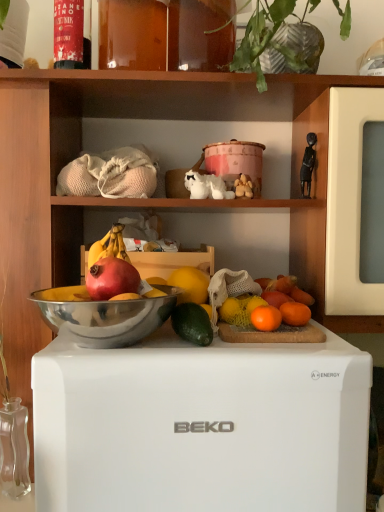
Measure the distance between point (299, 55) and camera.

The distance of point (299, 55) from camera is 36.10 inches.

Based on the photo, how much space does fuzzy beige stuffed animal at upper center, which ranks as the 2th toy in right-to-left order, occupy vertically?

It is 2.56 inches.

How much space does orange matte grapefruit at upper right, the 2th grapefruit in the right-to-left sequence, occupy vertically?

The height of orange matte grapefruit at upper right, the 2th grapefruit in the right-to-left sequence, is 1.46 inches.

This screenshot has height=512, width=384. What do you see at coordinates (295, 313) in the screenshot? I see `orange matte grapefruit at right, the 1th grapefruit in the right-to-left sequence` at bounding box center [295, 313].

At what (x,y) coordinates should I click in order to perform the action: click on green leafy plant at upper center. Please return your answer as a coordinate pair (x, y). This screenshot has height=512, width=384. Looking at the image, I should click on (269, 40).

Is orange matte grapefruit at right, positioned as the 3th grapefruit in front-to-back order, to the left or to the right of white matte refrigerator at center in the image?

Clearly, orange matte grapefruit at right, positioned as the 3th grapefruit in front-to-back order, is on the right of white matte refrigerator at center in the image.

Considering the relative sizes of orange matte grapefruit at right, the 3th grapefruit from the left, and white matte refrigerator at center in the image provided, is orange matte grapefruit at right, the 3th grapefruit from the left, thinner than white matte refrigerator at center?

Indeed, orange matte grapefruit at right, the 3th grapefruit from the left, has a lesser width compared to white matte refrigerator at center.

From the picture: What's the angular difference between orange matte grapefruit at right, the 3th grapefruit from the left, and white matte refrigerator at center's facing directions?

88.7 degrees separate the facing orientations of orange matte grapefruit at right, the 3th grapefruit from the left, and white matte refrigerator at center.

Are orange matte grapefruit at right, which ranks as the 1th grapefruit in back-to-front order, and white matte refrigerator at center beside each other?

No, orange matte grapefruit at right, which ranks as the 1th grapefruit in back-to-front order, is not touching white matte refrigerator at center.

Consider the image. Considering the relative positions of white ceramic dog at center and metallic silver bowl at center in the image provided, is white ceramic dog at center to the right of metallic silver bowl at center from the viewer's perspective?

Indeed, white ceramic dog at center is positioned on the right side of metallic silver bowl at center.

Is white ceramic dog at center closer to camera compared to metallic silver bowl at center?

No, the depth of white ceramic dog at center is greater than that of metallic silver bowl at center.

From a real-world perspective, is white ceramic dog at center positioned above or below metallic silver bowl at center?

In terms of real-world spatial position, white ceramic dog at center is above metallic silver bowl at center.

Is white ceramic dog at center wider or thinner than metallic silver bowl at center?

In the image, white ceramic dog at center appears to be more narrow than metallic silver bowl at center.

Could metallic silver bowl at center be considered to be inside black matte figurine at upper right, which ranks as the second toy in left-to-right order?

→ Actually, metallic silver bowl at center is outside black matte figurine at upper right, which ranks as the second toy in left-to-right order.

Is black matte figurine at upper right, which ranks as the second toy in left-to-right order, turned away from metallic silver bowl at center?

No, black matte figurine at upper right, which ranks as the second toy in left-to-right order, is not facing away from metallic silver bowl at center.

Which toy is the 2nd one when counting from the right side of the metallic silver bowl at center? Please provide its 2D coordinates.

[(308, 164)]

Consider the image. Which point is more forward, (306, 152) or (113, 330)?

The point (113, 330) is closer.

Which object is closer to the camera taking this photo, green matte avocado at center or black matte figurine at upper right, which ranks as the first toy in right-to-left order?

green matte avocado at center.

This screenshot has height=512, width=384. Find the location of `toy that is the 1st object located behind the green matte avocado at center`. toy that is the 1st object located behind the green matte avocado at center is located at coordinates (308, 164).

Which of these two, green matte avocado at center or black matte figurine at upper right, which ranks as the first toy in right-to-left order, stands shorter?

With less height is green matte avocado at center.

From the image's perspective, relative to black matte figurine at upper right, which ranks as the second toy in left-to-right order, is green matte avocado at center above or below?

From the image's perspective, green matte avocado at center appears below black matte figurine at upper right, which ranks as the second toy in left-to-right order.

From the image's perspective, is fuzzy beige stuffed animal at upper center, which is the first toy in left-to-right order, on white matte refrigerator at center?

Yes, from the image's perspective, fuzzy beige stuffed animal at upper center, which is the first toy in left-to-right order, is above white matte refrigerator at center.

Is fuzzy beige stuffed animal at upper center, which ranks as the 2th toy in right-to-left order, in contact with white matte refrigerator at center?

No, fuzzy beige stuffed animal at upper center, which ranks as the 2th toy in right-to-left order, is not in contact with white matte refrigerator at center.

Looking at this image, from a real-world perspective, does fuzzy beige stuffed animal at upper center, which is the first toy in left-to-right order, stand above white matte refrigerator at center?

Yes.

Considering the relative sizes of fuzzy beige stuffed animal at upper center, which is the first toy in left-to-right order, and white matte refrigerator at center in the image provided, is fuzzy beige stuffed animal at upper center, which is the first toy in left-to-right order, shorter than white matte refrigerator at center?

Yes, fuzzy beige stuffed animal at upper center, which is the first toy in left-to-right order, is shorter than white matte refrigerator at center.

From the image's perspective, is orange matte at center under white ceramic dog at center?

Yes, from the image's perspective, orange matte at center is below white ceramic dog at center.

In terms of width, does orange matte at center look wider or thinner when compared to white ceramic dog at center?

Clearly, orange matte at center has less width compared to white ceramic dog at center.

Considering the positions of objects orange matte at center and white ceramic dog at center in the image provided, who is behind, orange matte at center or white ceramic dog at center?

white ceramic dog at center is more distant.

Is orange matte at center not close to white ceramic dog at center?

No, orange matte at center is not far away from white ceramic dog at center.

Is orange matte grapefruit at right, which ranks as the 1th grapefruit in back-to-front order, with orange matte at center?

orange matte grapefruit at right, which ranks as the 1th grapefruit in back-to-front order, and orange matte at center are clearly separated.

In the scene shown: Considering the relative sizes of orange matte grapefruit at right, the 1th grapefruit in the right-to-left sequence, and orange matte at center in the image provided, is orange matte grapefruit at right, the 1th grapefruit in the right-to-left sequence, wider than orange matte at center?

No, orange matte grapefruit at right, the 1th grapefruit in the right-to-left sequence, is not wider than orange matte at center.

Do you think orange matte grapefruit at right, which ranks as the 1th grapefruit in back-to-front order, is within orange matte at center, or outside of it?

orange matte grapefruit at right, which ranks as the 1th grapefruit in back-to-front order, is not inside orange matte at center, it's outside.

From a real-world perspective, which is physically above, orange matte grapefruit at right, the 1th grapefruit in the right-to-left sequence, or orange matte at center?

orange matte at center is physically above.

Locate an element on the screen. the 3rd grapefruit behind when counting from the white matte refrigerator at center is located at coordinates (295, 313).

This screenshot has height=512, width=384. In order to click on animal above the metallic silver bowl at center (from a real-world perspective) in this screenshot , I will do `click(206, 186)`.

Which object lies nearer to the anchor point white ceramic dog at center, orange matte grapefruit at right, the 1th grapefruit in the right-to-left sequence, or green matte avocado at center?

orange matte grapefruit at right, the 1th grapefruit in the right-to-left sequence, lies closer to white ceramic dog at center than the other object.

Looking at the image, which one is located further to white ceramic dog at center, fuzzy beige stuffed animal at upper center, which ranks as the 2th toy in right-to-left order, or orange matte grapefruit at upper right, the 2th grapefruit in the right-to-left sequence?

Among the two, orange matte grapefruit at upper right, the 2th grapefruit in the right-to-left sequence, is located further to white ceramic dog at center.

From the image, which object appears to be farther from green matte avocado at center, orange matte grapefruit at right, the 3th grapefruit from the left, or green leafy plant at upper center?

green leafy plant at upper center is further to green matte avocado at center.

Consider the image. Looking at the image, which one is located further to white ceramic dog at center, black matte figurine at upper right, which ranks as the second toy in left-to-right order, or green matte avocado at center?

Among the two, green matte avocado at center is located further to white ceramic dog at center.

Considering their positions, is orange matte at center positioned closer to black matte figurine at upper right, which ranks as the first toy in right-to-left order, than fuzzy beige stuffed animal at upper center, which is the first toy in left-to-right order?

Based on the image, fuzzy beige stuffed animal at upper center, which is the first toy in left-to-right order, appears to be nearer to black matte figurine at upper right, which ranks as the first toy in right-to-left order.

Considering their positions, is fuzzy beige stuffed animal at upper center, which ranks as the 2th toy in right-to-left order, positioned closer to orange matte at center than white ceramic dog at center?

Among the two, white ceramic dog at center is located nearer to orange matte at center.

When comparing their distances from orange matte at center, does black matte figurine at upper right, which ranks as the first toy in right-to-left order, or white ceramic dog at center seem closer?

white ceramic dog at center lies closer to orange matte at center than the other object.

Considering their positions, is black matte figurine at upper right, which ranks as the second toy in left-to-right order, positioned further to green matte avocado at center than green leafy plant at upper center?

green leafy plant at upper center is positioned further to the anchor green matte avocado at center.

At what (x,y) coordinates should I click in order to perform the action: click on animal between green leafy plant at upper center and fuzzy beige stuffed animal at upper center, which is the first toy in left-to-right order, from top to bottom. Please return your answer as a coordinate pair (x, y). Looking at the image, I should click on (206, 186).

The height and width of the screenshot is (512, 384). I want to click on bowl between red matte grapefruit at center, positioned as the 1th grapefruit in front-to-back order, and black matte figurine at upper right, which ranks as the second toy in left-to-right order, so click(103, 315).

The width and height of the screenshot is (384, 512). Find the location of `grapefruit between red matte grapefruit at center, placed as the 3th grapefruit when sorted from back to front, and orange matte grapefruit at right, which ranks as the 1th grapefruit in back-to-front order, from left to right`. grapefruit between red matte grapefruit at center, placed as the 3th grapefruit when sorted from back to front, and orange matte grapefruit at right, which ranks as the 1th grapefruit in back-to-front order, from left to right is located at coordinates (266, 318).

Locate an element on the screen. toy between black matte figurine at upper right, which ranks as the second toy in left-to-right order, and white matte refrigerator at center vertically is located at coordinates (243, 186).